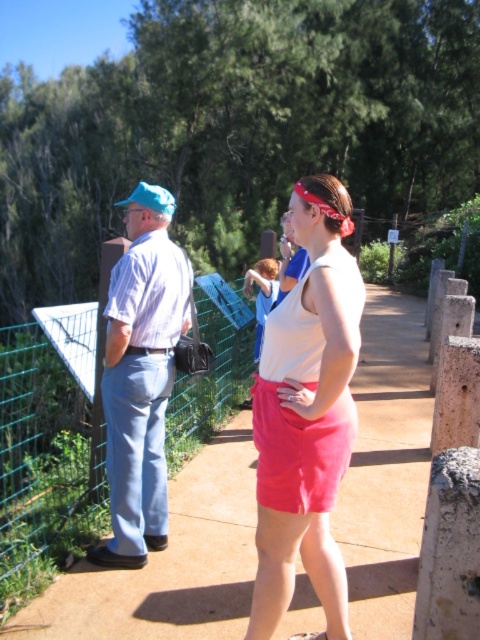
You are a visitor at the park and want to know the position of the green wire mesh fence at left relative to the light blue denim pants at left. Based on the scene description, which object is positioned to the right?

The green wire mesh fence at left is to the right of light blue denim pants at left according to the description.

You are a delivery person trying to reach a package that is on the sandy concrete sidewalk at center. There is a green wire mesh fence at left blocking your path. Can you walk around the fence to access the sidewalk?

The sandy concrete sidewalk at center is positioned under the green wire mesh fence at left, which means the fence is above the sidewalk. Since the fence is above, you can walk around it to reach the sidewalk.

You are a visitor at the park and see the green wire mesh fence at left and the light blue denim pants at left. Which object is closer to you?

The light blue denim pants at left is behind the green wire mesh fence at left, so the green wire mesh fence at left is closer to you.